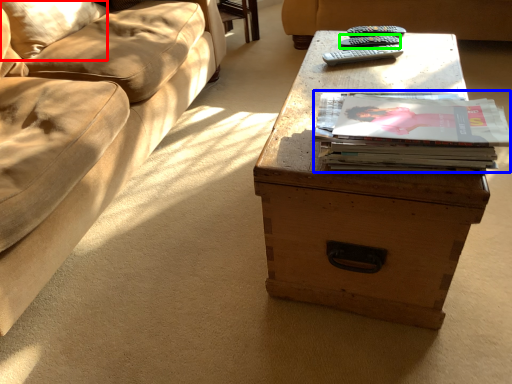
Question: Estimate the real-world distances between objects in this image. Which object is closer to pillow (highlighted by a red box), paperback book (highlighted by a blue box) or remote (highlighted by a green box)?

Choices:
 (A) paperback book
 (B) remote

Answer: (B)